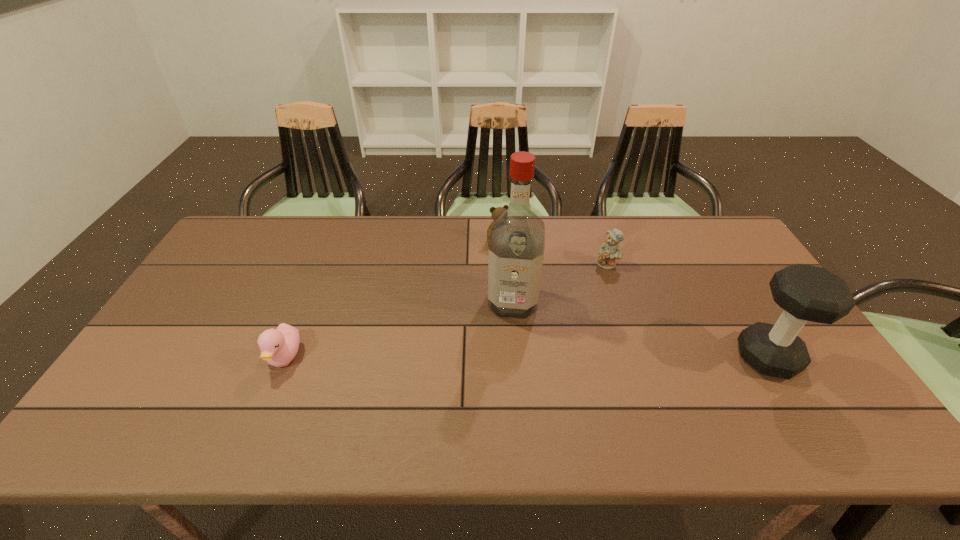
You are a GUI agent. You are given a task and a screenshot of the screen. Output one action in this format:
    pyautogui.click(x=<x>, y=<y>)
    Task: Click on the free space between the shortest object and the tallest object
    This screenshot has width=960, height=540.
    Given the screenshot: What is the action you would take?
    pyautogui.click(x=399, y=329)

Identify the location of free space that is in between the shortest object and the third nearest object. This screenshot has height=540, width=960. (399, 329).

The image size is (960, 540). In order to click on vacant space in between the tallest object and the leftmost object in this screenshot , I will do `click(399, 329)`.

Where is `free space between the farther teddy bear and the leftmost object`? The image size is (960, 540). free space between the farther teddy bear and the leftmost object is located at coordinates (394, 300).

I want to click on vacant region between the nearer teddy bear and the duckling, so click(445, 311).

Locate an element on the screen. The height and width of the screenshot is (540, 960). vacant region between the nearer teddy bear and the farther teddy bear is located at coordinates (554, 253).

This screenshot has height=540, width=960. Identify the location of vacant area between the dumbbell and the second object from right to left. (687, 311).

Find the location of a particular element. This screenshot has height=540, width=960. free point between the shortest object and the liquor is located at coordinates (399, 329).

Locate an element on the screen. The width and height of the screenshot is (960, 540). free space between the leftmost object and the farther teddy bear is located at coordinates (394, 300).

At what (x,y) coordinates should I click in order to perform the action: click on object that is the fourth closest one to the farthest object. Please return your answer as a coordinate pair (x, y). Looking at the image, I should click on (806, 293).